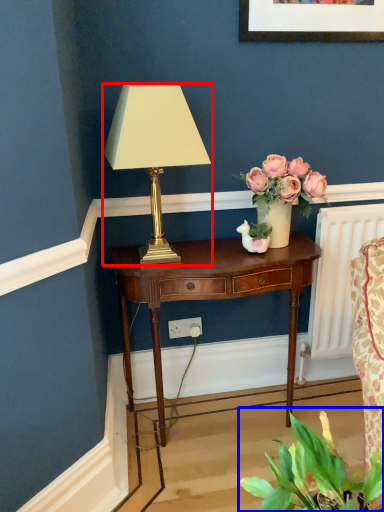
Question: Among these objects, which one is nearest to the camera, lamp (highlighted by a red box) or houseplant (highlighted by a blue box)?

Choices:
 (A) lamp
 (B) houseplant

Answer: (B)